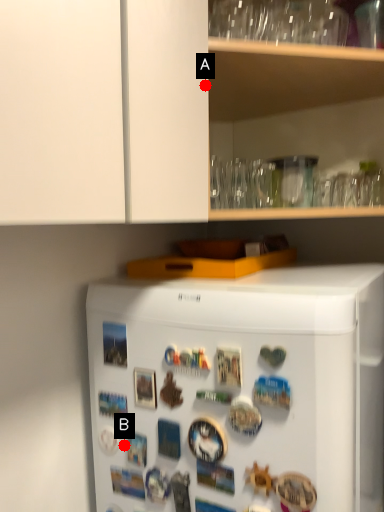
Question: Two points are circled on the image, labeled by A and B beside each circle. Among these points, which one is nearest to the camera?

Choices:
 (A) A is closer
 (B) B is closer

Answer: (A)